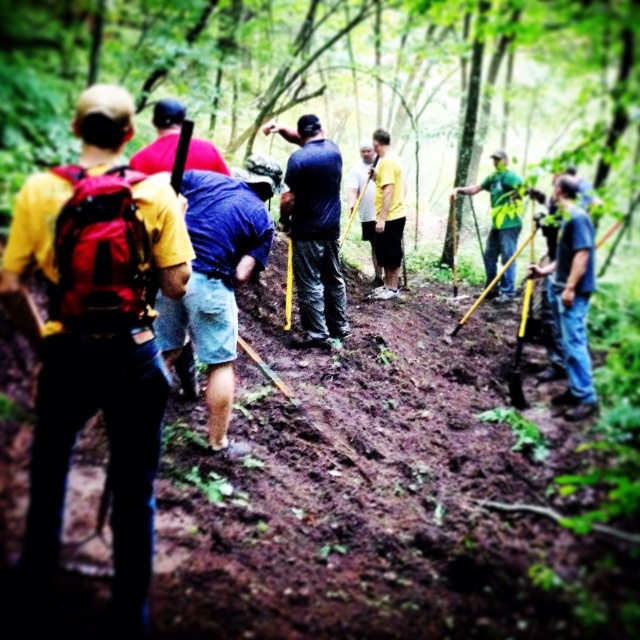
You are a hiker planning to join the group working on the trail. You need to know which item is bigger so you can pack accordingly. Which is larger, the yellow matte backpack at left or the green matte shirt at center?

The yellow matte backpack at left is larger in size than the green matte shirt at center, so the backpack is bigger.

You are a hiker planning to carry both the yellow matte backpack at left and the blue denim shorts at center. Since you have limited space, which item should you choose to take based on their sizes?

The yellow matte backpack at left is wider than the blue denim shorts at center, so you should take the blue denim shorts at center if you have limited space.

You are a hiker carrying a 1.2 meter long pole. You need to pass between the yellow matte backpack at left and the blue denim shorts at center. Can you fit through the space between them without bending the pole?

The distance between the yellow matte backpack at left and the blue denim shorts at center is 1.03 meters. Since the pole is 1.2 meters long, it is longer than the available space. Therefore, you cannot fit through the space without bending the pole.